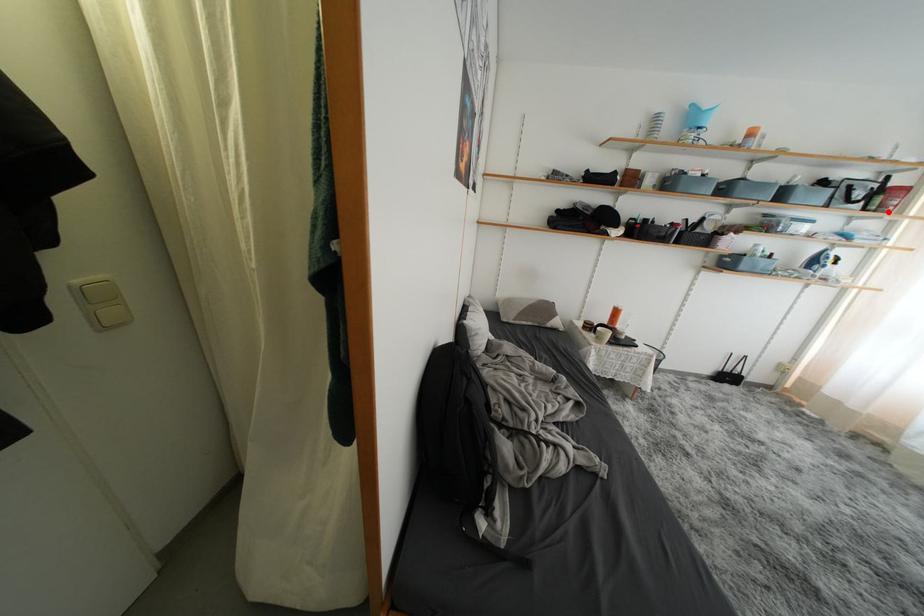
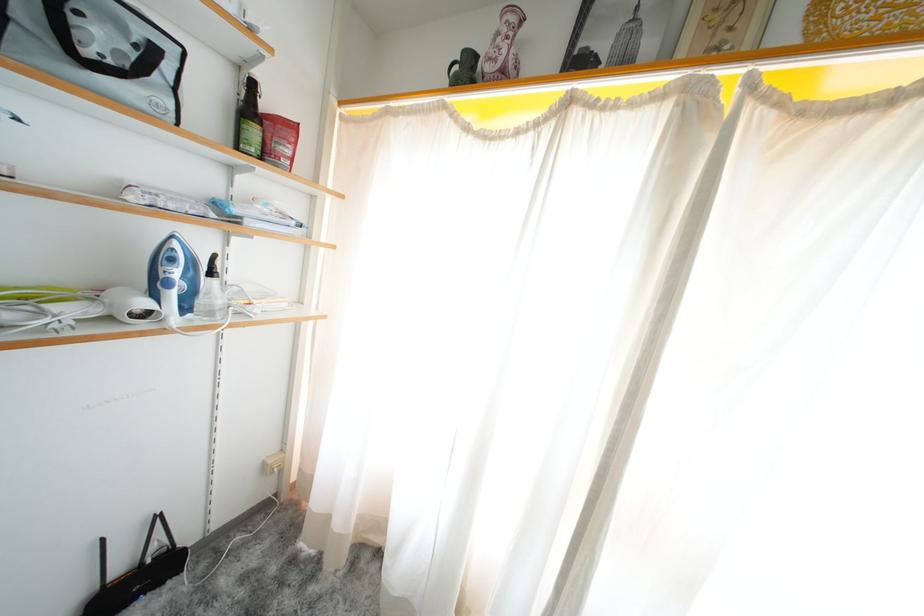
Find the pixel in the second image that matches the highlighted location in the first image.

(273, 158)